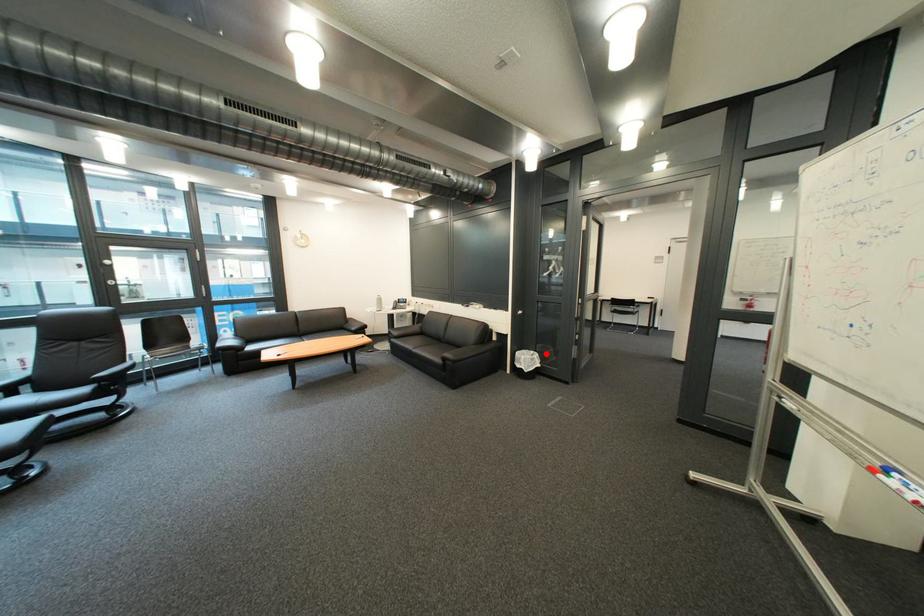
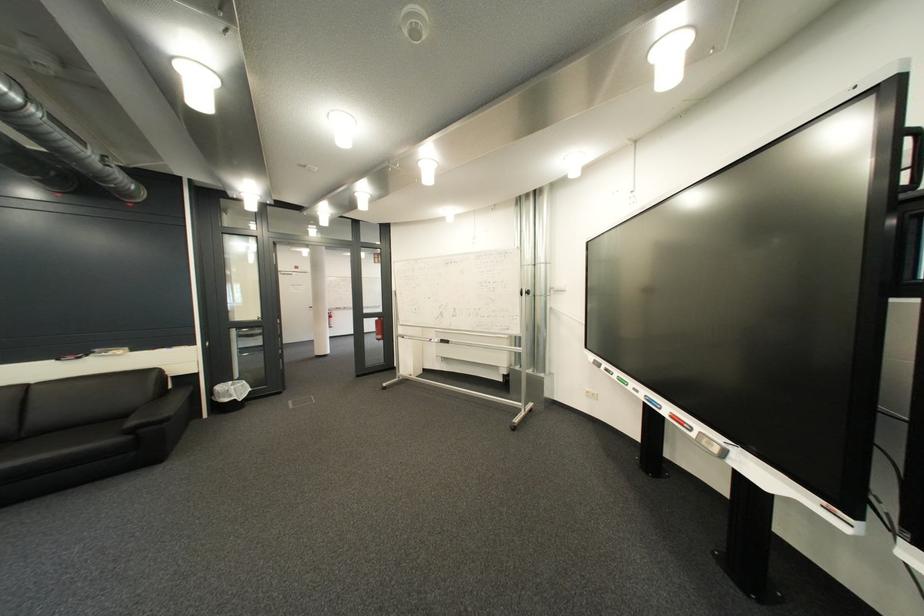
In the second image, find the point that corresponds to the highlighted location in the first image.

(245, 384)